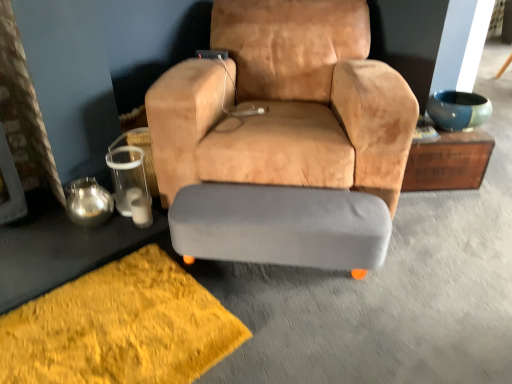
Image resolution: width=512 pixels, height=384 pixels. I want to click on blank space situated above gray fabric ottoman at center (from a real-world perspective), so click(x=261, y=207).